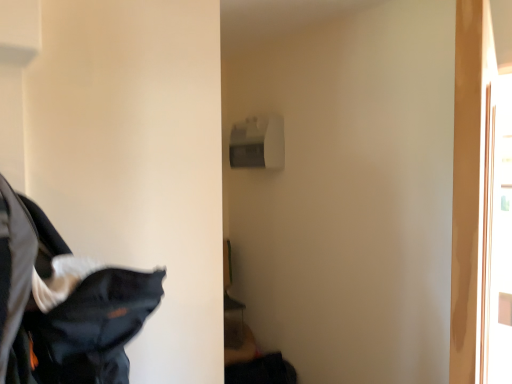
Question: Should I look upward or downward to see dark blue fabric at lower left?

Choices:
 (A) down
 (B) up

Answer: (A)

Question: Can you confirm if dark blue fabric at lower left is smaller than transparent glass screen door at right?

Choices:
 (A) no
 (B) yes

Answer: (A)

Question: From a real-world perspective, is dark blue fabric at lower left over transparent glass screen door at right?

Choices:
 (A) yes
 (B) no

Answer: (B)

Question: Is dark blue fabric at lower left completely or partially outside of transparent glass screen door at right?

Choices:
 (A) no
 (B) yes

Answer: (B)

Question: Does dark blue fabric at lower left appear on the left side of transparent glass screen door at right?

Choices:
 (A) yes
 (B) no

Answer: (A)

Question: From the image's perspective, is dark blue fabric at lower left under transparent glass screen door at right?

Choices:
 (A) yes
 (B) no

Answer: (A)

Question: Could you tell me if dark blue fabric at lower left is facing transparent glass screen door at right?

Choices:
 (A) yes
 (B) no

Answer: (B)

Question: From the image's perspective, is transparent glass screen door at right on dark blue fabric at lower left?

Choices:
 (A) no
 (B) yes

Answer: (B)

Question: Considering the relative sizes of transparent glass screen door at right and dark blue fabric at lower left in the image provided, is transparent glass screen door at right smaller than dark blue fabric at lower left?

Choices:
 (A) yes
 (B) no

Answer: (A)

Question: Considering the relative sizes of transparent glass screen door at right and dark blue fabric at lower left in the image provided, is transparent glass screen door at right bigger than dark blue fabric at lower left?

Choices:
 (A) yes
 (B) no

Answer: (B)

Question: Is transparent glass screen door at right located outside dark blue fabric at lower left?

Choices:
 (A) yes
 (B) no

Answer: (A)

Question: From the image's perspective, would you say transparent glass screen door at right is shown under dark blue fabric at lower left?

Choices:
 (A) yes
 (B) no

Answer: (B)

Question: Is transparent glass screen door at right thinner than dark blue fabric at lower left?

Choices:
 (A) no
 (B) yes

Answer: (B)

Question: Is transparent glass screen door at right taller or shorter than dark blue fabric at lower left?

Choices:
 (A) tall
 (B) short

Answer: (A)